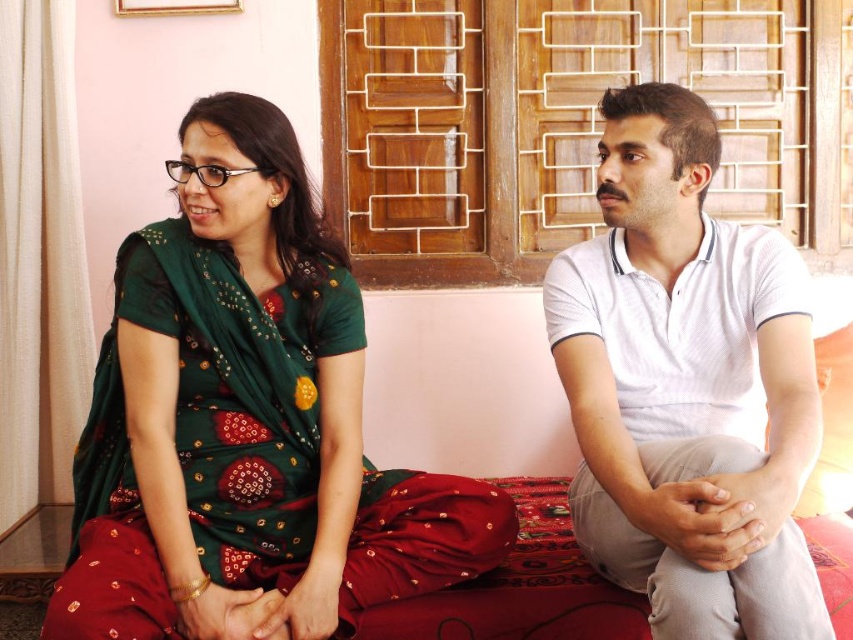
Question: Which point is closer to the camera?

Choices:
 (A) white cotton shirt at center
 (B) green embroidered saree at left

Answer: (A)

Question: Does green embroidered saree at left appear under white cotton shirt at center?

Choices:
 (A) no
 (B) yes

Answer: (B)

Question: Among these objects, which one is farthest from the camera?

Choices:
 (A) green embroidered saree at left
 (B) white cotton shirt at center

Answer: (A)

Question: Is green embroidered saree at left positioned in front of white cotton shirt at center?

Choices:
 (A) no
 (B) yes

Answer: (A)

Question: Which point is farther to the camera?

Choices:
 (A) (86, 586)
 (B) (809, 340)

Answer: (B)

Question: Is green embroidered saree at left to the right of white cotton shirt at center from the viewer's perspective?

Choices:
 (A) no
 (B) yes

Answer: (A)